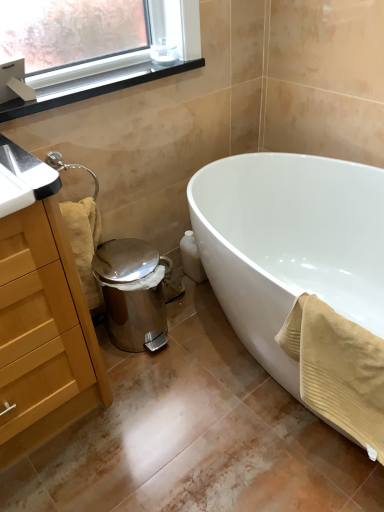
You are a GUI agent. You are given a task and a screenshot of the screen. Output one action in this format:
    pyautogui.click(x=<x>, y=<y>)
    Task: Click on the vacant space underneath beige textured towel at lower right, which appears as the 2th bath towel when viewed from the back (from a real-world perspective)
    
    Given the screenshot: What is the action you would take?
    pyautogui.click(x=304, y=458)